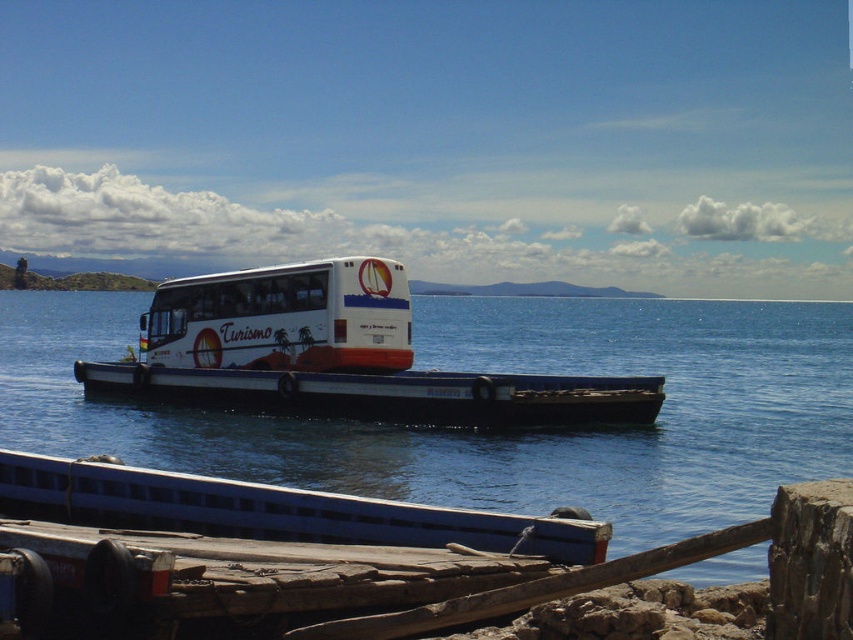
You are standing on the deck of the barge and want to know where the blue water at center is located. Can you determine its position based on the coordinates provided?

The blue water at center is located at coordinates point (488, 429).

You are a marine biologist observing two boats in the water. The blue painted wood boat at lower center and the white matte boat at center. Which boat is shorter?

The blue painted wood boat at lower center is shorter than the white matte boat at center.

You are standing on the deck of the barge and want to move from point A to point B. Point A is at coordinate point (195, 513) and point B is at coordinate point (196, 403). Which point is closer to you when you start at point A?

Point A at coordinate point (195, 513) is closer to you than point B at coordinate point (196, 403) because the description states that point (195, 513) is closer to the viewer than point (196, 403).